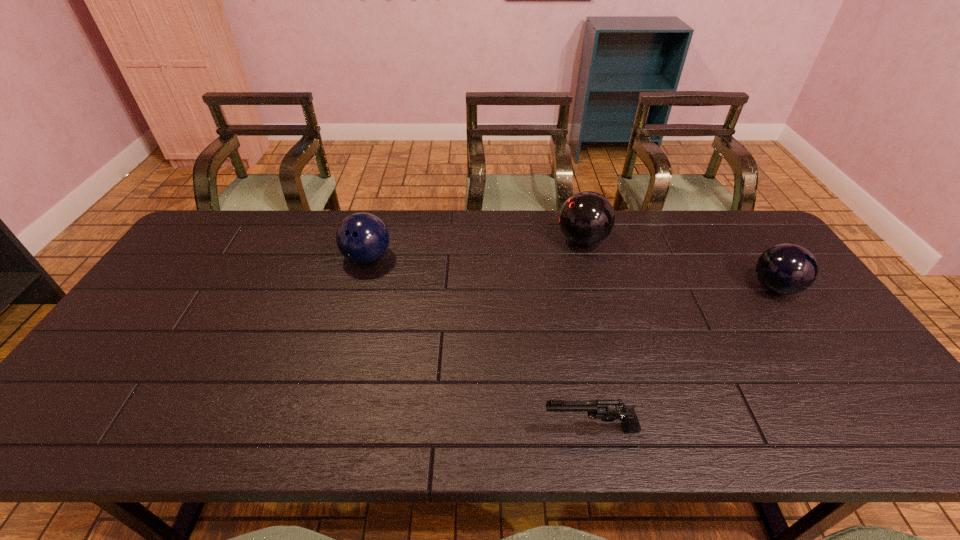
Find the location of a particular element. The width and height of the screenshot is (960, 540). vacant area that lies between the second bowling ball from left to right and the rightmost bowling ball is located at coordinates (679, 264).

At what (x,y) coordinates should I click in order to perform the action: click on free space between the leftmost object and the rightmost bowling ball. Please return your answer as a coordinate pair (x, y). The height and width of the screenshot is (540, 960). Looking at the image, I should click on (571, 273).

You are a GUI agent. You are given a task and a screenshot of the screen. Output one action in this format:
    pyautogui.click(x=<x>, y=<y>)
    Task: Click on the object that is the third closest one to the second bowling ball from left to right
    
    Given the screenshot: What is the action you would take?
    pyautogui.click(x=607, y=410)

Identify the location of object that is the second closest one to the nearest object. The width and height of the screenshot is (960, 540). pos(786,269).

Locate an element on the screen. the closest bowling ball to the leftmost bowling ball is located at coordinates (587, 218).

You are a GUI agent. You are given a task and a screenshot of the screen. Output one action in this format:
    pyautogui.click(x=<x>, y=<y>)
    Task: Click on the bowling ball that is the second closest to the leftmost bowling ball
    
    Given the screenshot: What is the action you would take?
    pyautogui.click(x=786, y=269)

Find the location of a particular element. The height and width of the screenshot is (540, 960). free location that satisfies the following two spatial constraints: 1. on the surface of the second bowling ball from right to left near the finger holes; 2. on the surface of the leftmost object near the finger holes is located at coordinates (588, 258).